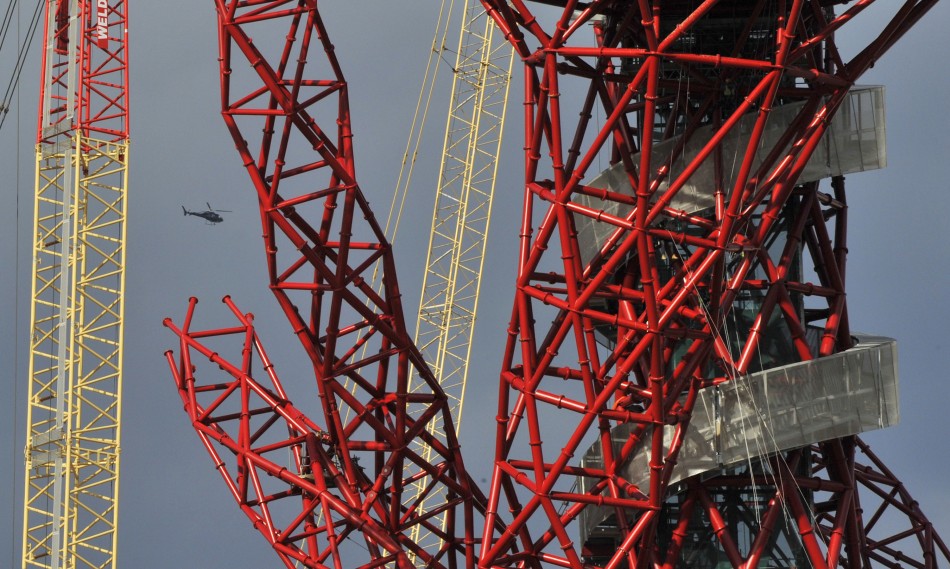
Locate an element on the screen. Image resolution: width=950 pixels, height=569 pixels. stairs is located at coordinates (57, 346), (57, 486), (70, 64), (39, 68).